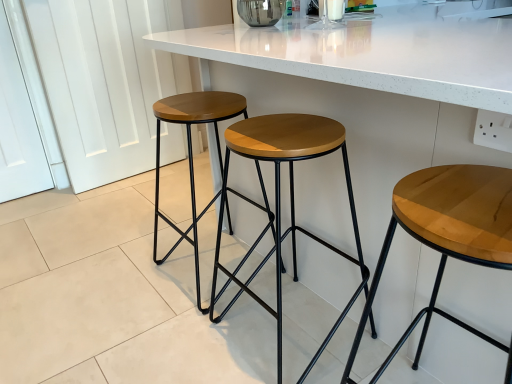
Question: From a real-world perspective, is white marble countertop at center above or below wooden/matte stool at center, which is the third stool from right to left?

Choices:
 (A) above
 (B) below

Answer: (A)

Question: From the image's perspective, relative to wooden/matte stool at center, the first stool when ordered from left to right, is white marble countertop at center above or below?

Choices:
 (A) above
 (B) below

Answer: (A)

Question: Based on their relative distances, which object is farther from the light brown wood stool at center, the first stool positioned from the right?

Choices:
 (A) woodenmaterial/texturestool at center, positioned as the second stool in right-to-left order
 (B) wooden/matte stool at center, which is the third stool from right to left
 (C) white marble countertop at center

Answer: (B)

Question: Which object is positioned farthest from the wooden/matte stool at center, the first stool when ordered from left to right?

Choices:
 (A) light brown wood stool at center, positioned as the third stool in left-to-right order
 (B) white marble countertop at center
 (C) woodenmaterial/texturestool at center, positioned as the second stool in right-to-left order

Answer: (A)